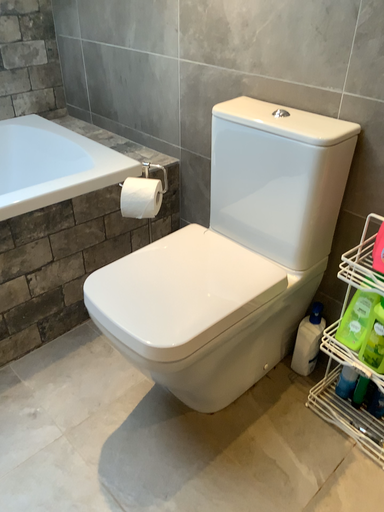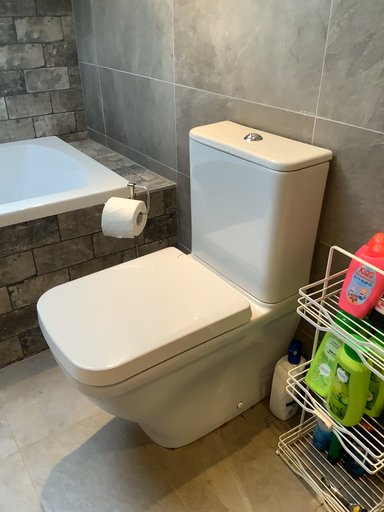
Question: Which way did the camera rotate in the video?

Choices:
 (A) rotated left
 (B) rotated right

Answer: (A)